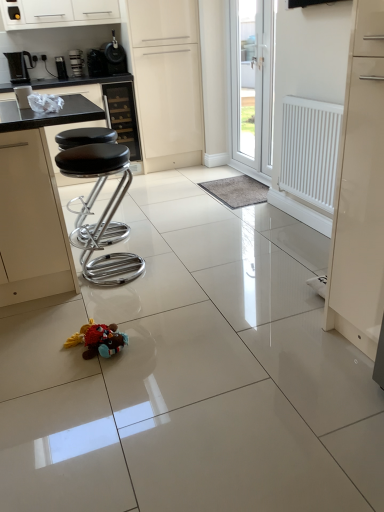
What do you see at coordinates (123, 116) in the screenshot?
I see `black leather cabinet at upper center, which is the first cabinetry from bottom to top` at bounding box center [123, 116].

The width and height of the screenshot is (384, 512). I want to click on black leather cabinet at upper center, which is the first cabinetry from bottom to top, so click(x=123, y=116).

The height and width of the screenshot is (512, 384). What do you see at coordinates (310, 150) in the screenshot? I see `white plastic radiator at right` at bounding box center [310, 150].

This screenshot has width=384, height=512. Describe the element at coordinates (102, 213) in the screenshot. I see `black leather stool at left` at that location.

This screenshot has width=384, height=512. In order to click on metallic black coffee machine at upper left, positioned as the 2th appliance in left-to-right order in this screenshot , I will do `click(97, 63)`.

The height and width of the screenshot is (512, 384). Find the location of `black plastic coffee machine at left, which ranks as the first coffee machine in left-to-right order`. black plastic coffee machine at left, which ranks as the first coffee machine in left-to-right order is located at coordinates (19, 66).

Which is more to the right, black matte coffee maker at upper left, the 4th appliance from the bottom, or plush multicolored toy at center?

Positioned to the right is plush multicolored toy at center.

Is black matte coffee maker at upper left, the 4th appliance from the bottom, oriented towards plush multicolored toy at center?

No, black matte coffee maker at upper left, the 4th appliance from the bottom, is not oriented towards plush multicolored toy at center.

Is black matte coffee maker at upper left, the 4th appliance positioned from the left, shorter than plush multicolored toy at center?

Incorrect, the height of black matte coffee maker at upper left, the 4th appliance positioned from the left, does not fall short of that of plush multicolored toy at center.

Can you confirm if white matte door at center, acting as the second door starting from the right, is positioned to the left of black leather stool at left?

No, white matte door at center, acting as the second door starting from the right, is not to the left of black leather stool at left.

Which is less distant, (x=186, y=97) or (x=107, y=234)?

Point (x=107, y=234)

From a real-world perspective, is white matte door at center, acting as the second door starting from the right, under black leather stool at left?

Incorrect, from a real-world perspective, white matte door at center, acting as the second door starting from the right, is higher than black leather stool at left.

Locate an element on the screen. door that is the 2nd one when counting upward from the black leather stool at left (from the image's perspective) is located at coordinates (167, 81).

From the image's perspective, is black leather stool at left above or below white plastic bag at upper left, the 3th appliance from the left?

From the image's perspective, black leather stool at left appears below white plastic bag at upper left, the 3th appliance from the left.

Which is behind, point (67, 170) or point (19, 103)?

The point (67, 170) is farther.

Consider the image. Is black leather stool at left oriented towards white plastic bag at upper left, which is counted as the fourth appliance, starting from the back?

No, black leather stool at left is not turned towards white plastic bag at upper left, which is counted as the fourth appliance, starting from the back.

Is plush multicolored toy at center spatially inside white plastic radiator at right, or outside of it?

plush multicolored toy at center is not inside white plastic radiator at right, it's outside.

Does plush multicolored toy at center appear on the right side of white plastic radiator at right?

In fact, plush multicolored toy at center is to the left of white plastic radiator at right.

Considering the sizes of objects plush multicolored toy at center and white plastic radiator at right in the image provided, who is taller, plush multicolored toy at center or white plastic radiator at right?

With more height is white plastic radiator at right.

How different are the orientations of black plastic coffee machine at left, which ranks as the 2th coffee machine in right-to-left order, and white plastic bag at upper left, which is counted as the fourth appliance, starting from the back, in degrees?

The angular difference between black plastic coffee machine at left, which ranks as the 2th coffee machine in right-to-left order, and white plastic bag at upper left, which is counted as the fourth appliance, starting from the back, is 172 degrees.

Considering the relative sizes of black plastic coffee machine at left, which ranks as the first coffee machine in left-to-right order, and white plastic bag at upper left, which is the second appliance from right to left, in the image provided, is black plastic coffee machine at left, which ranks as the first coffee machine in left-to-right order, bigger than white plastic bag at upper left, which is the second appliance from right to left,?

Yes, black plastic coffee machine at left, which ranks as the first coffee machine in left-to-right order, is bigger than white plastic bag at upper left, which is the second appliance from right to left.

Measure the distance from black plastic coffee machine at left, which ranks as the 2th coffee machine in right-to-left order, to white plastic bag at upper left, which is counted as the fourth appliance, starting from the back.

black plastic coffee machine at left, which ranks as the 2th coffee machine in right-to-left order, is 5.42 feet away from white plastic bag at upper left, which is counted as the fourth appliance, starting from the back.

Is black plastic coffee machine at left, which ranks as the 2th coffee machine in right-to-left order, in contact with white plastic bag at upper left, positioned as the 1th appliance in front-to-back order?

They are not placed beside each other.

From the image's perspective, which one is positioned higher, black leather bar stools at left or black matte coffee maker at upper left, placed as the second appliance when sorted from front to back?

black matte coffee maker at upper left, placed as the second appliance when sorted from front to back.

Considering the relative sizes of black leather bar stools at left and black matte coffee maker at upper left, the 4th appliance positioned from the left, in the image provided, is black leather bar stools at left smaller than black matte coffee maker at upper left, the 4th appliance positioned from the left,?

No.

Between metallic black coffee machine at upper left, positioned as the 2th appliance in left-to-right order, and white plastic bag at upper left, positioned as the 1th appliance in bottom-to-top order, which one is positioned in front?

white plastic bag at upper left, positioned as the 1th appliance in bottom-to-top order, is closer to the camera.

From a real-world perspective, relative to white plastic bag at upper left, which is counted as the fourth appliance, starting from the back, is metallic black coffee machine at upper left, arranged as the 2th appliance when viewed from the top, vertically above or below?

metallic black coffee machine at upper left, arranged as the 2th appliance when viewed from the top, is above white plastic bag at upper left, which is counted as the fourth appliance, starting from the back.

Is metallic black coffee machine at upper left, positioned as the 2th appliance in left-to-right order, wider or thinner than white plastic bag at upper left, which is counted as the fourth appliance, starting from the back?

In the image, metallic black coffee machine at upper left, positioned as the 2th appliance in left-to-right order, appears to be wider than white plastic bag at upper left, which is counted as the fourth appliance, starting from the back.

Is metallic black coffee machine at upper left, marked as the third appliance in a right-to-left arrangement, bigger than white plastic bag at upper left, which is the second appliance from right to left?

Indeed, metallic black coffee machine at upper left, marked as the third appliance in a right-to-left arrangement, has a larger size compared to white plastic bag at upper left, which is the second appliance from right to left.

This screenshot has width=384, height=512. In order to click on toy that appears below the black matte coffee maker at upper left, the 4th appliance positioned from the left (from the image's perspective) in this screenshot , I will do `click(98, 340)`.

I want to click on door that is the 2nd one when counting upward from the black leather stool at left (from the image's perspective), so click(167, 81).

In the scene shown: Which object lies nearer to the anchor point brushed metal coffee machine at upper left, which is the third appliance from top to bottom, plush multicolored toy at center or metallic black coffee machine at upper left, which is the third appliance in bottom-to-top order?

metallic black coffee machine at upper left, which is the third appliance in bottom-to-top order, is closer to brushed metal coffee machine at upper left, which is the third appliance from top to bottom.

Which object lies further to the anchor point white glossy door at upper center, arranged as the 1th door when viewed from the right, black leather bar stools at left or white matte door at center, acting as the second door starting from the right?

Based on the image, black leather bar stools at left appears to be further to white glossy door at upper center, arranged as the 1th door when viewed from the right.

Which object lies further to the anchor point white matte door at center, the first door viewed from the left, black leather stool at left or black leather bar stools at left?

black leather bar stools at left is positioned further to the anchor white matte door at center, the first door viewed from the left.

Based on their spatial positions, is brushed metal coffee machine at upper left, marked as the first appliance in a back-to-front arrangement, or black matte coffee maker at upper left, the third appliance from the back, further from white glossy door at upper center, the 2th door in the left-to-right sequence?

brushed metal coffee machine at upper left, marked as the first appliance in a back-to-front arrangement.

When comparing their distances from metallic black coffee machine at upper left, the 3th appliance positioned from the front, does white plastic radiator at right or brushed metal coffee machine at upper left, the 4th appliance viewed from the front, seem further?

white plastic radiator at right is positioned further to the anchor metallic black coffee machine at upper left, the 3th appliance positioned from the front.

Which object lies further to the anchor point black plastic coffee machine at left, which ranks as the first coffee machine in left-to-right order, brushed metal coffee machine at upper left, the 4th appliance in the right-to-left sequence, or black leather cabinet at upper center, which is the second cabinetry from top to bottom?

Among the two, black leather cabinet at upper center, which is the second cabinetry from top to bottom, is located further to black plastic coffee machine at left, which ranks as the first coffee machine in left-to-right order.

Estimate the real-world distances between objects in this image. Which object is further from black plastic coffee machine at left, which ranks as the first coffee machine in left-to-right order, white plastic bag at upper left, positioned as the 1th appliance in front-to-back order, or satin black coffee machine at upper left, which is counted as the second coffee machine, starting from the left?

The object further to black plastic coffee machine at left, which ranks as the first coffee machine in left-to-right order, is white plastic bag at upper left, positioned as the 1th appliance in front-to-back order.

Considering their positions, is black leather stool at left positioned further to black matte coffee maker at upper left, which is the first appliance in top-to-bottom order, than satin black coffee machine at upper left, which is the 1th coffee machine in right-to-left order?

black leather stool at left is positioned further to the anchor black matte coffee maker at upper left, which is the first appliance in top-to-bottom order.

Locate an element on the screen. The height and width of the screenshot is (512, 384). counter top between plush multicolored toy at center and black plastic coffee machine at left, which ranks as the 2th coffee machine in right-to-left order, along the z-axis is located at coordinates coord(34,203).

At what (x,y) coordinates should I click in order to perform the action: click on coffee machine between white glossy cabinet at upper center, placed as the first cabinetry when sorted from top to bottom, and white matte door at center, acting as the second door starting from the right. Please return your answer as a coordinate pair (x, y). The image size is (384, 512). Looking at the image, I should click on (76, 62).

The image size is (384, 512). Find the location of `coffee machine located between black plastic coffee machine at left, which ranks as the first coffee machine in left-to-right order, and white glossy door at upper center, arranged as the 1th door when viewed from the right, in the left-right direction`. coffee machine located between black plastic coffee machine at left, which ranks as the first coffee machine in left-to-right order, and white glossy door at upper center, arranged as the 1th door when viewed from the right, in the left-right direction is located at coordinates click(x=76, y=62).

This screenshot has height=512, width=384. I want to click on coffee machine between black plastic coffee machine at left, which ranks as the first coffee machine in left-to-right order, and white plastic radiator at right from left to right, so click(x=76, y=62).